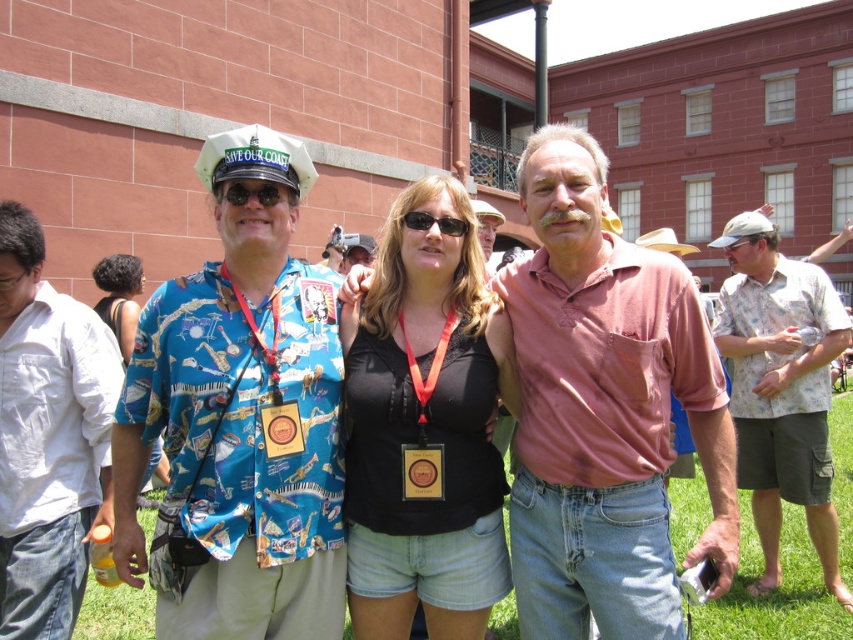
Question: Which object appears farthest from the camera in this image?

Choices:
 (A) shiny black goggles at center
 (B) white cotton shirt at left

Answer: (B)

Question: Observing the image, what is the correct spatial positioning of white cotton shirt at left in reference to floral cotton shirt at right?

Choices:
 (A) right
 (B) left

Answer: (B)

Question: Which of the following is the farthest from the observer?

Choices:
 (A) (20, 627)
 (B) (247, 157)

Answer: (A)

Question: Which point is closer to the camera taking this photo?

Choices:
 (A) (749, 429)
 (B) (131, 310)
 (C) (7, 308)

Answer: (C)

Question: From the image, what is the correct spatial relationship of pink cotton shirt at center in relation to floral cotton shirt at right?

Choices:
 (A) below
 (B) above

Answer: (B)

Question: Does white cotton shirt at left have a smaller size compared to green grass at center?

Choices:
 (A) no
 (B) yes

Answer: (B)